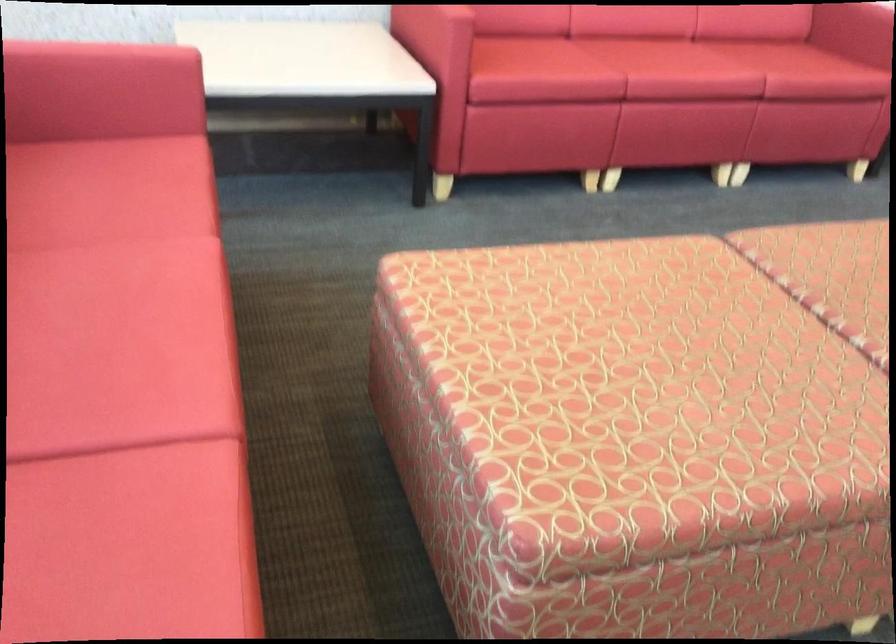
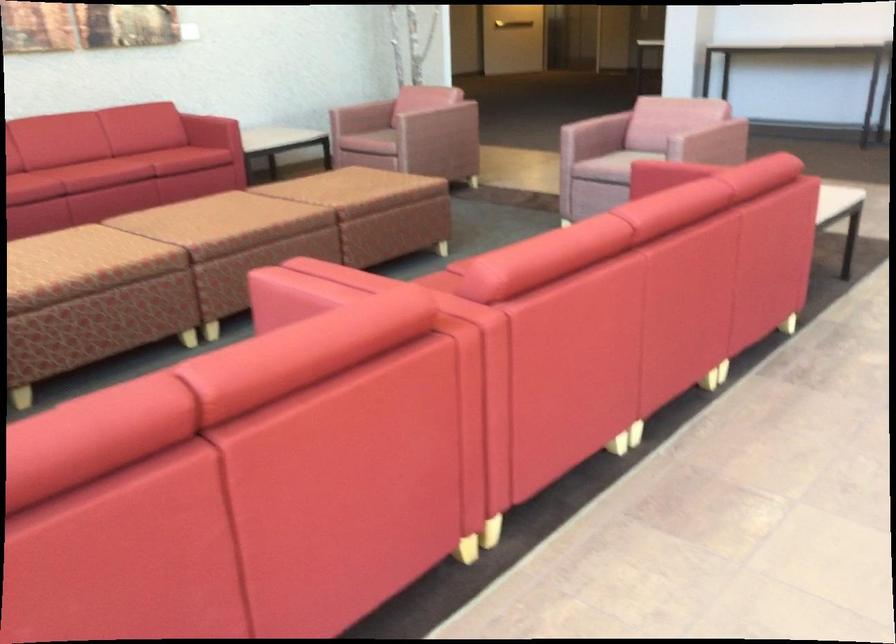
Find the pixel in the second image that matches pixel 677 62 in the first image.

(99, 165)